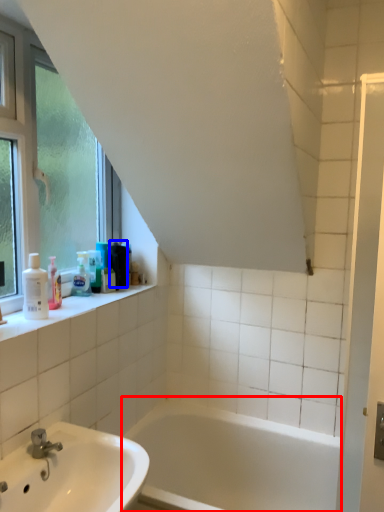
Question: Which object appears closest to the camera in this image, bathtub (highlighted by a red box) or toiletry (highlighted by a blue box)?

Choices:
 (A) bathtub
 (B) toiletry

Answer: (A)